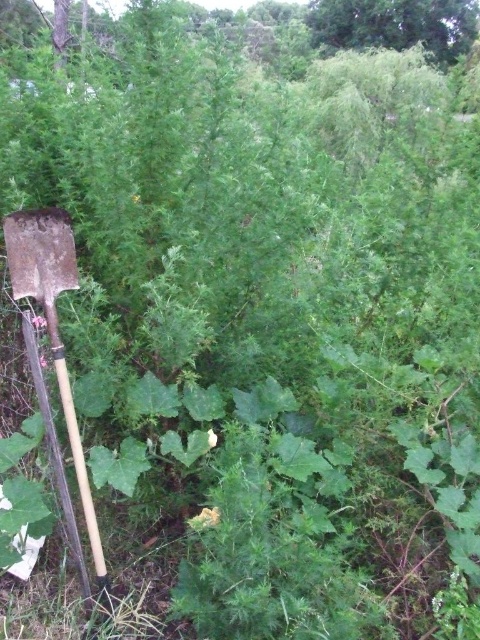
Question: Is wooden shovel at left closer to camera compared to green leafy tree at upper center?

Choices:
 (A) no
 (B) yes

Answer: (B)

Question: Which object appears closest to the camera in this image?

Choices:
 (A) green leafy tree at upper center
 (B) wooden shovel at left

Answer: (B)

Question: Which point is closer to the camera?

Choices:
 (A) green leafy tree at upper center
 (B) wooden shovel at left

Answer: (B)

Question: Among these points, which one is nearest to the camera?

Choices:
 (A) [25, 285]
 (B) [316, 4]

Answer: (A)

Question: Does wooden shovel at left appear over green leafy tree at upper center?

Choices:
 (A) no
 (B) yes

Answer: (A)

Question: Is wooden shovel at left further to the viewer compared to green leafy tree at upper center?

Choices:
 (A) no
 (B) yes

Answer: (A)